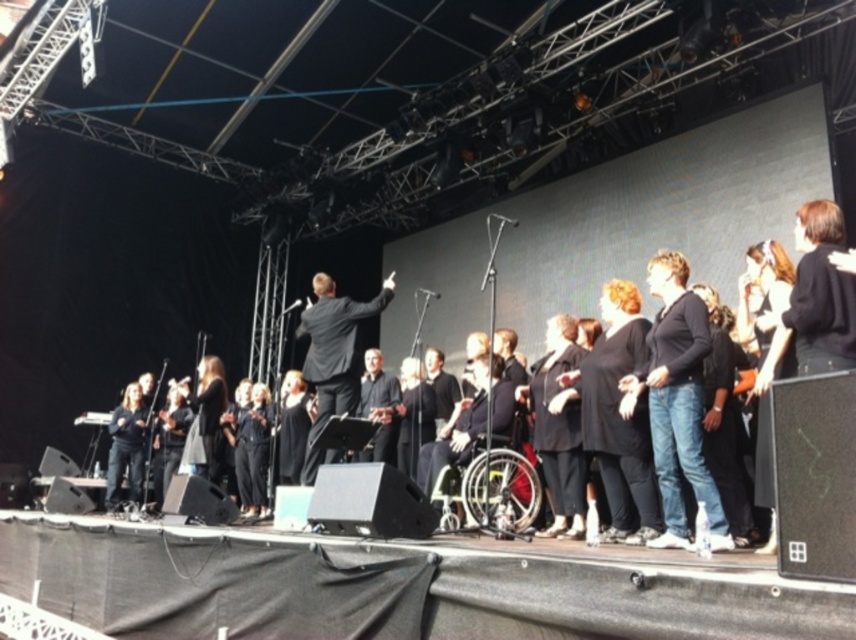
You are a stagehand positioned at the front of the stage. You need to adjust a spotlight that is currently shining on the black matte suit at center. To do this, you must move directly towards the suit. Which direction should you move from your current position at the front of the stage?

Since the black matte suit at center is located at point 0.472 on the x and 0.950 on the y axis, you should move towards the center of the stage and slightly to the right to reach it.

You are a stagehand adjusting the lighting for the choir performance. You need to ensure that the spotlight reaches both the black matte suit at center and the black suit at center. Given their height difference, which performer should you adjust the spotlight for first to ensure proper illumination?

The black matte suit at center has a lesser height compared to black suit at center. Therefore, you should first adjust the spotlight for the black matte suit at center to ensure it is properly illuminated before adjusting for the taller black suit at center.